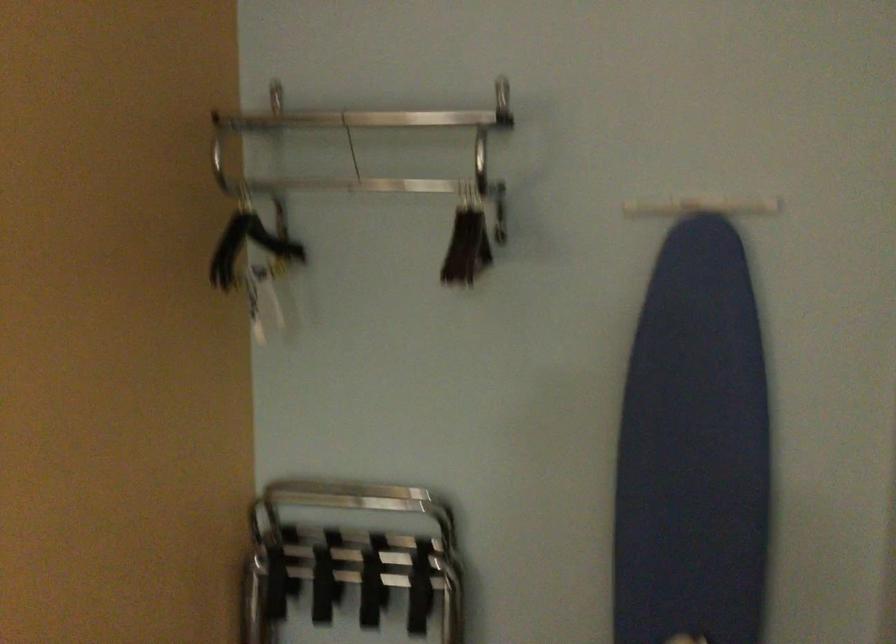
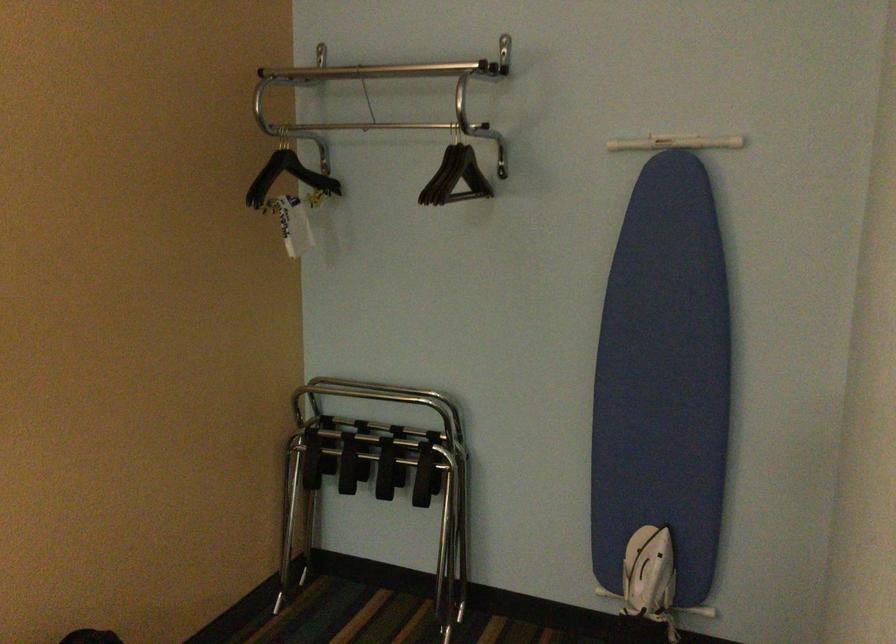
The point at (243, 243) is marked in the first image. Where is the corresponding point in the second image?

(288, 176)